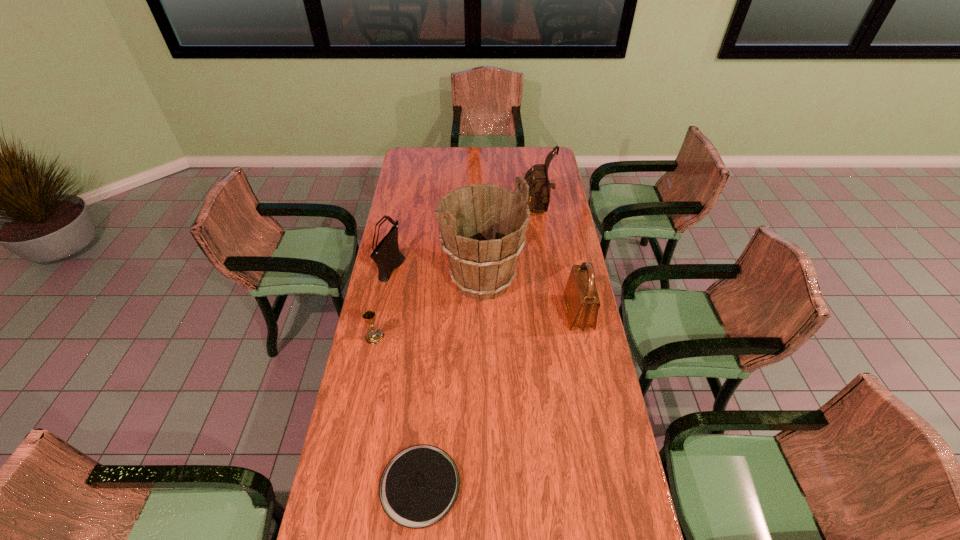
The width and height of the screenshot is (960, 540). In order to click on vacant space at the far edge of the desktop in this screenshot , I will do `click(436, 164)`.

Where is `vacant region at the left edge of the desktop`? vacant region at the left edge of the desktop is located at coordinates (382, 522).

In the image, there is a desktop. At what (x,y) coordinates should I click in order to perform the action: click on vacant space at the right edge. Please return your answer as a coordinate pair (x, y). The image size is (960, 540). Looking at the image, I should click on pyautogui.click(x=554, y=348).

You are a GUI agent. You are given a task and a screenshot of the screen. Output one action in this format:
    pyautogui.click(x=<x>, y=<y>)
    Task: Click on the free space at the far left corner of the desktop
    Image resolution: width=960 pixels, height=540 pixels.
    Given the screenshot: What is the action you would take?
    pyautogui.click(x=419, y=156)

You are a GUI agent. You are given a task and a screenshot of the screen. Output one action in this format:
    pyautogui.click(x=<x>, y=<y>)
    Task: Click on the vacant area between the chalice and the shortest object
    
    Given the screenshot: What is the action you would take?
    pyautogui.click(x=397, y=411)

At what (x,y) coordinates should I click in order to perform the action: click on free space between the nearest shoulder bag and the farthest shoulder bag. Please return your answer as a coordinate pair (x, y). The image size is (960, 540). Looking at the image, I should click on (558, 262).

Where is `free point between the chalice and the nearest shoulder bag`? free point between the chalice and the nearest shoulder bag is located at coordinates (476, 325).

I want to click on vacant space in between the chalice and the nearest object, so click(x=397, y=411).

This screenshot has height=540, width=960. Identify the location of free point between the chalice and the leftmost shoulder bag. (383, 301).

I want to click on vacant area that lies between the farthest shoulder bag and the nearest shoulder bag, so click(558, 262).